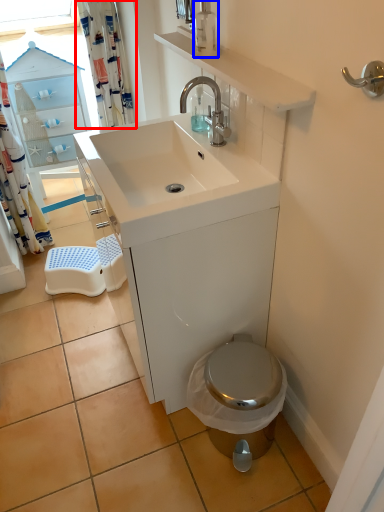
Question: Which object appears closest to the camera in this image, shower curtain (highlighted by a red box) or soap dispenser (highlighted by a blue box)?

Choices:
 (A) shower curtain
 (B) soap dispenser

Answer: (B)